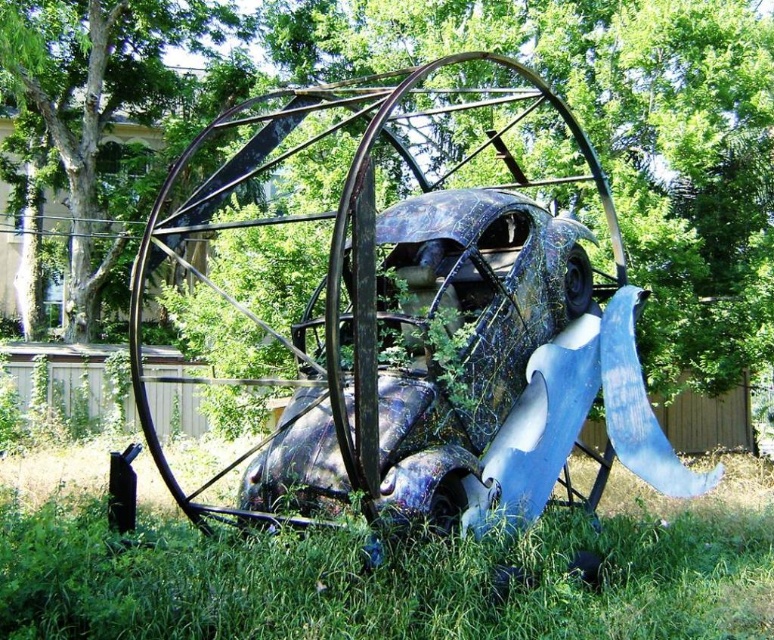
You are standing in the garden and see the repurposed Volkswagen Beetle sculpture. There is a point marked at coordinates [586,131]. Which object in the scene does this point belong to?

The point at coordinates [586,131] is on the green leafy tree at center.

You are standing in the garden and want to take a photo of the Volkswagen Beetle sculpture. The green grass at lower center and the green leafy tree at upper center are both in your view. Which object is closer to you, the photographer?

The green grass at lower center is closer to you because it is in front of the green leafy tree at upper center.

You are standing in front of the Volkswagen Beetle sculpture and want to know how far the point at coordinates (632,576) is from your current position. Can you determine the distance?

Answer: The point at coordinates (632,576) is 4.18 meters away from the camera, so the distance from your current position to that point is approximately 4.18 meters.